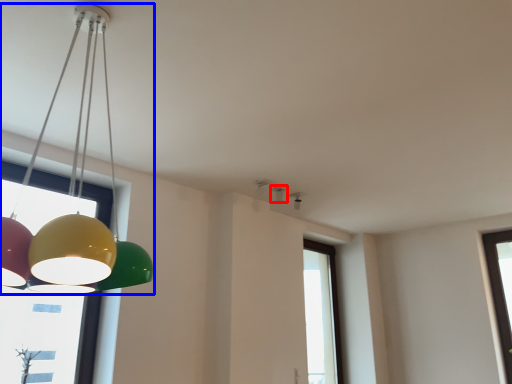
Question: Among these objects, which one is farthest to the camera, lamp (highlighted by a red box) or lamp (highlighted by a blue box)?

Choices:
 (A) lamp
 (B) lamp

Answer: (A)